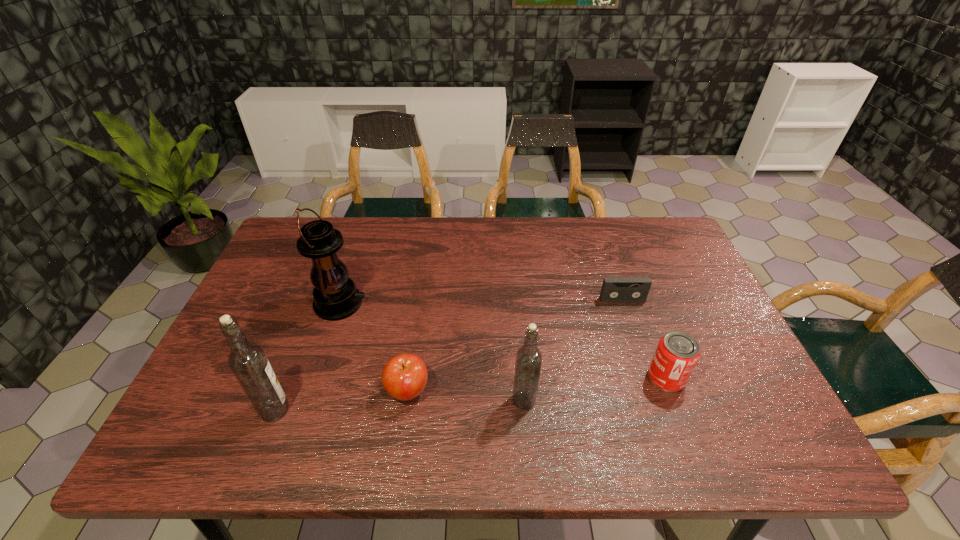
Pinpoint the vacant space located above the lantern, indicating its light source. Please provide its 2D coordinates. Your answer should be formatted as a tuple, i.e. [(x, y)], where the tuple contains the x and y coordinates of a point satisfying the conditions above.

[(510, 304)]

This screenshot has height=540, width=960. Identify the location of vacant space located 0.110m on the front-facing side of the videotape. (634, 333).

Identify the location of vacant area situated 0.100m on the right of the can. (727, 378).

You are a GUI agent. You are given a task and a screenshot of the screen. Output one action in this format:
    pyautogui.click(x=<x>, y=<y>)
    Task: Click on the vacant space situated on the left of the apple
    
    Given the screenshot: What is the action you would take?
    pyautogui.click(x=316, y=391)

What are the coordinates of `can positioned at the near edge` in the screenshot? It's located at (677, 353).

Find the location of `apple situated at the near edge`. apple situated at the near edge is located at coordinates (404, 377).

Locate an element on the screen. The height and width of the screenshot is (540, 960). object located at the left edge is located at coordinates (247, 360).

Where is `object positioned at the near left corner`? This screenshot has width=960, height=540. object positioned at the near left corner is located at coordinates (247, 360).

This screenshot has height=540, width=960. What are the coordinates of `vacant space at the far edge of the desktop` in the screenshot? It's located at (546, 260).

Identify the location of vacant space at the near edge of the desktop. The image size is (960, 540). (384, 398).